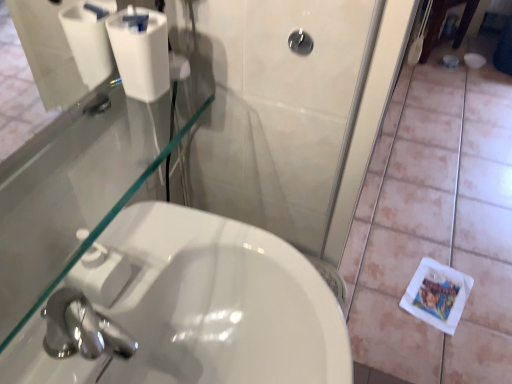
Question: Can you confirm if white matte tile at lower right is smaller than black glossy showerhead at upper center?

Choices:
 (A) yes
 (B) no

Answer: (B)

Question: Does white matte tile at lower right have a greater width compared to black glossy showerhead at upper center?

Choices:
 (A) no
 (B) yes

Answer: (B)

Question: From a real-world perspective, is white matte tile at lower right positioned under black glossy showerhead at upper center based on gravity?

Choices:
 (A) no
 (B) yes

Answer: (B)

Question: From a real-world perspective, is white matte tile at lower right physically above black glossy showerhead at upper center?

Choices:
 (A) no
 (B) yes

Answer: (A)

Question: Can you confirm if white matte tile at lower right is shorter than black glossy showerhead at upper center?

Choices:
 (A) no
 (B) yes

Answer: (A)

Question: From the image's perspective, is white matte tile at lower right over black glossy showerhead at upper center?

Choices:
 (A) yes
 (B) no

Answer: (A)

Question: Is white matte toilet paper at upper left facing towards white matte tile at lower right?

Choices:
 (A) yes
 (B) no

Answer: (B)

Question: Is white matte toilet paper at upper left positioned beyond the bounds of white matte tile at lower right?

Choices:
 (A) yes
 (B) no

Answer: (A)

Question: Does white matte toilet paper at upper left have a larger size compared to white matte tile at lower right?

Choices:
 (A) no
 (B) yes

Answer: (A)

Question: Considering the relative positions of white matte toilet paper at upper left and white matte tile at lower right in the image provided, is white matte toilet paper at upper left to the left of white matte tile at lower right from the viewer's perspective?

Choices:
 (A) yes
 (B) no

Answer: (A)

Question: Does white matte toilet paper at upper left have a greater width compared to white matte tile at lower right?

Choices:
 (A) yes
 (B) no

Answer: (B)

Question: Is white matte toilet paper at upper left to the right of white matte tile at lower right from the viewer's perspective?

Choices:
 (A) no
 (B) yes

Answer: (A)

Question: Is white glossy sink at lower left at the back of white matte toilet paper at upper left?

Choices:
 (A) yes
 (B) no

Answer: (B)